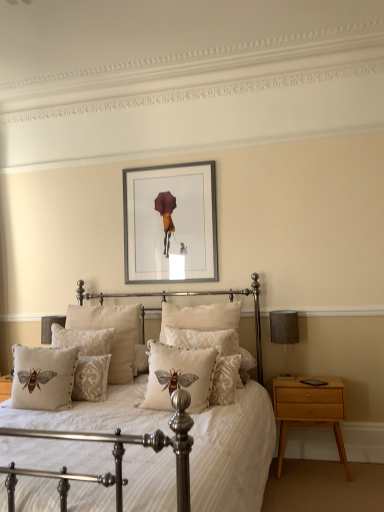
At what (x,y) coordinates should I click in order to perform the action: click on free space above silver metallic picture frame at upper center (from a real-world perspective). Please return your answer as a coordinate pair (x, y). The height and width of the screenshot is (512, 384). Looking at the image, I should click on (160, 165).